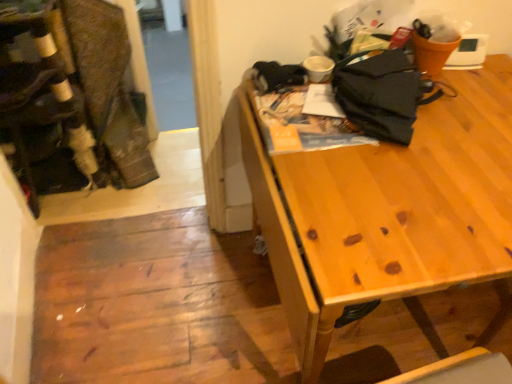
You are a GUI agent. You are given a task and a screenshot of the screen. Output one action in this format:
    pyautogui.click(x=<x>, y=<y>)
    Task: Click on the free space in front of black fabric umbrella at upper right
    The image size is (512, 384).
    Given the screenshot: What is the action you would take?
    pyautogui.click(x=424, y=197)